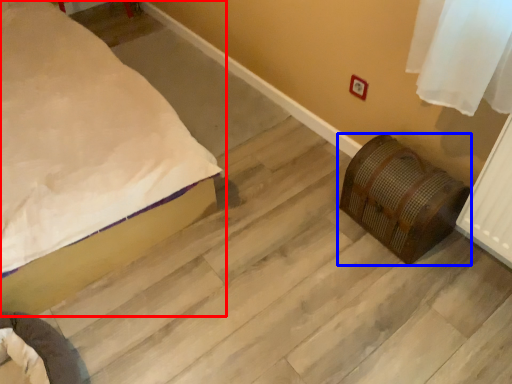
Question: Which object is further to the camera taking this photo, bed (highlighted by a red box) or furniture (highlighted by a blue box)?

Choices:
 (A) bed
 (B) furniture

Answer: (B)